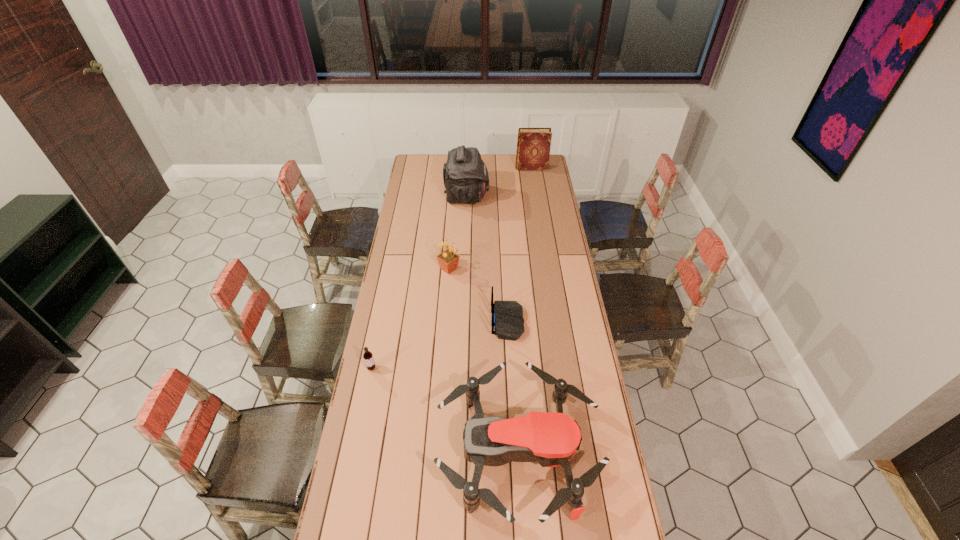
I want to click on free spot between the sunflower and the third nearest object, so click(478, 295).

Locate an element on the screen. The width and height of the screenshot is (960, 540). free space between the sunflower and the nearest object is located at coordinates (x=483, y=361).

Identify the location of vacant area between the sunflower and the second nearest object. (410, 319).

You are a GUI agent. You are given a task and a screenshot of the screen. Output one action in this format:
    pyautogui.click(x=<x>, y=<y>)
    Task: Click on the vacant area that lies between the second farthest object and the second tallest object
    This screenshot has height=540, width=960.
    Given the screenshot: What is the action you would take?
    pyautogui.click(x=499, y=183)

At what (x,y) coordinates should I click in order to perform the action: click on vacant space in between the router and the third farthest object. Please return your answer as a coordinate pair (x, y). Looking at the image, I should click on (478, 295).

You are a GUI agent. You are given a task and a screenshot of the screen. Output one action in this format:
    pyautogui.click(x=<x>, y=<y>)
    Task: Click on the unoccupied position between the tallest object and the fifth shortest object
    This screenshot has height=540, width=960.
    Given the screenshot: What is the action you would take?
    pyautogui.click(x=499, y=183)

This screenshot has height=540, width=960. Identify the location of vacant space in between the leftmost object and the third farthest object. (410, 319).

I want to click on vacant area that lies between the fifth shortest object and the fourth shortest object, so click(490, 218).

The width and height of the screenshot is (960, 540). Identify the location of object that is the closest to the leftmost object. (552, 439).

At what (x,y) coordinates should I click in order to perform the action: click on object that is the fifth nearest to the leftmost object. Please return your answer as a coordinate pair (x, y). Looking at the image, I should click on (533, 147).